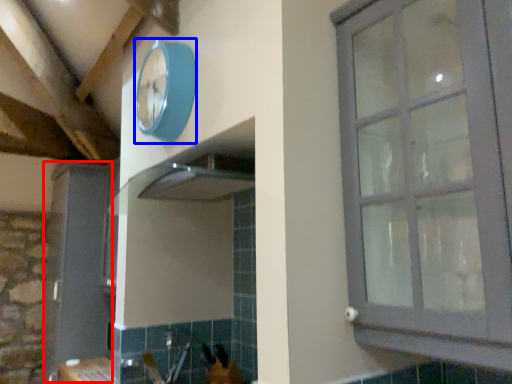
Question: Which object is closer to the camera taking this photo, screen door (highlighted by a red box) or clock (highlighted by a blue box)?

Choices:
 (A) screen door
 (B) clock

Answer: (B)